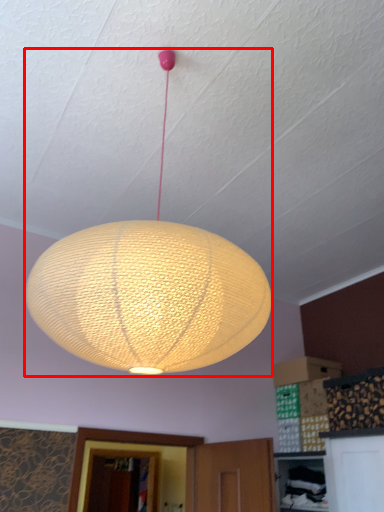
Question: Observing the image, what is the correct spatial positioning of lamp (annotated by the red box) in reference to lantern?

Choices:
 (A) left
 (B) right

Answer: (B)